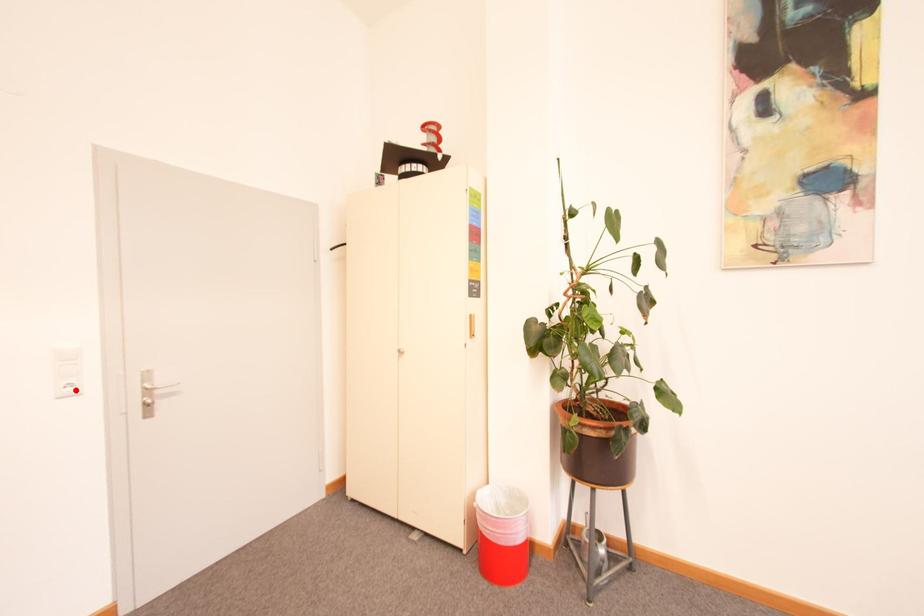
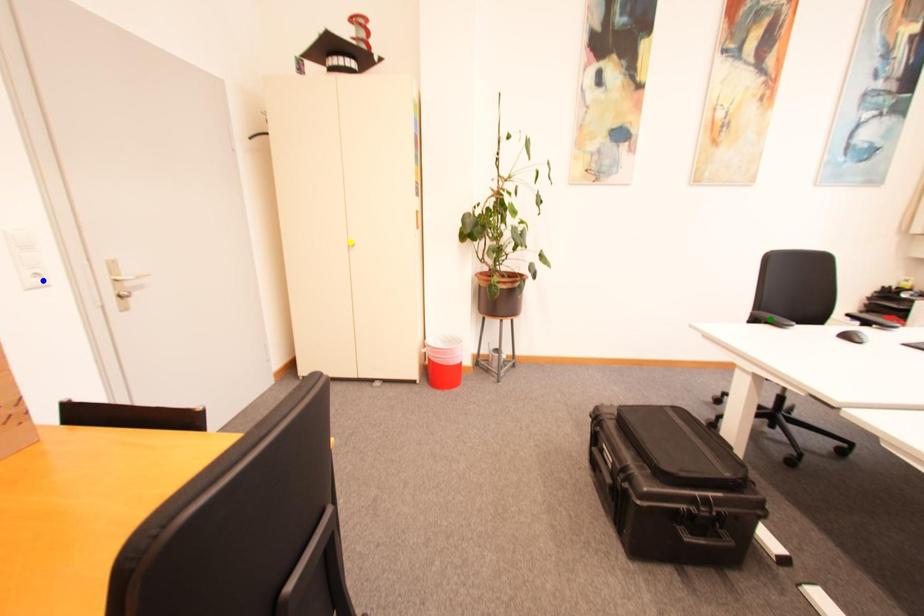
Question: I am providing you with two images of the same scene from different viewpoints. A red point is marked on the first image. You are given multiple points on the second image. Which mark in image 2 goes with the point in image 1?

Choices:
 (A) green point
 (B) yellow point
 (C) blue point

Answer: (C)